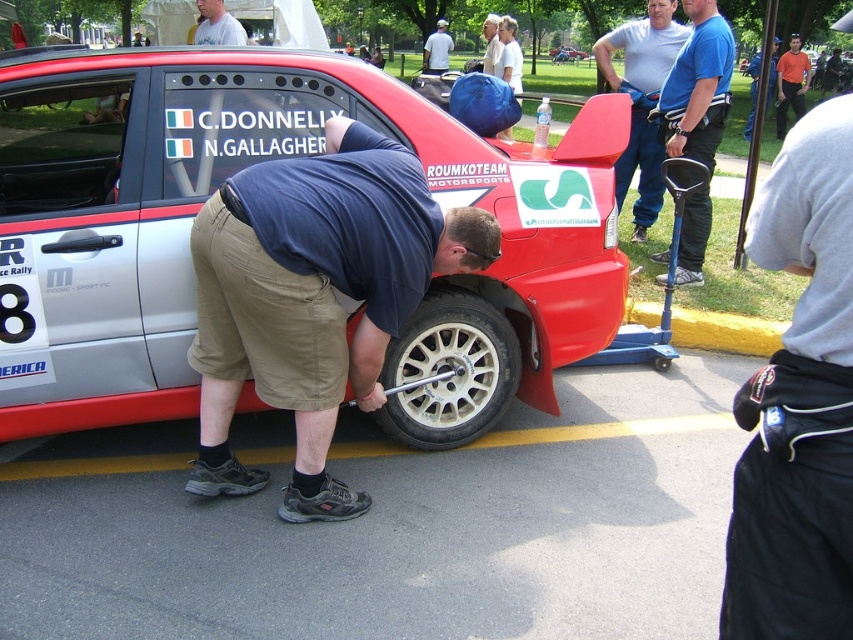
Question: Can you confirm if orange shirt at center is positioned above light blue shirt at lower center?

Choices:
 (A) yes
 (B) no

Answer: (A)

Question: Among these points, which one is farthest from the camera?

Choices:
 (A) (799, 83)
 (B) (578, 56)
 (C) (744, 486)

Answer: (B)

Question: Is white cotton shirt at center behind orange shirt at upper right?

Choices:
 (A) yes
 (B) no

Answer: (B)

Question: Which point is farther to the camera?

Choices:
 (A) matte blue cap at upper right
 (B) light blue shirt at lower center
 (C) matte black tire at lower center

Answer: (B)

Question: Which point is farther from the camera taking this photo?

Choices:
 (A) (202, 13)
 (B) (813, 134)
 (C) (407, 198)

Answer: (A)

Question: Does orange shirt at center have a larger size compared to white cotton shirt at upper center?

Choices:
 (A) no
 (B) yes

Answer: (A)